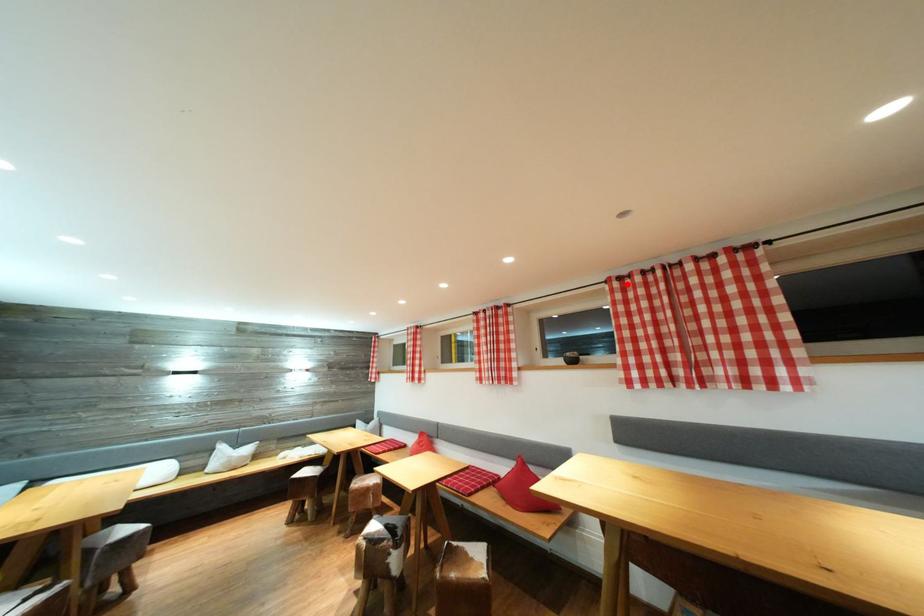
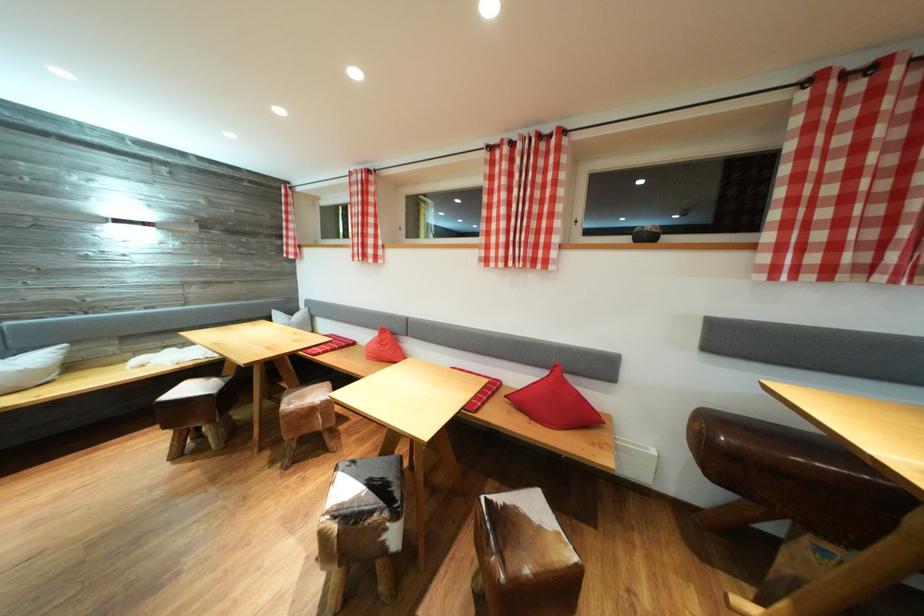
The point at the highlighted location is marked in the first image. Where is the corresponding point in the second image?

(852, 81)